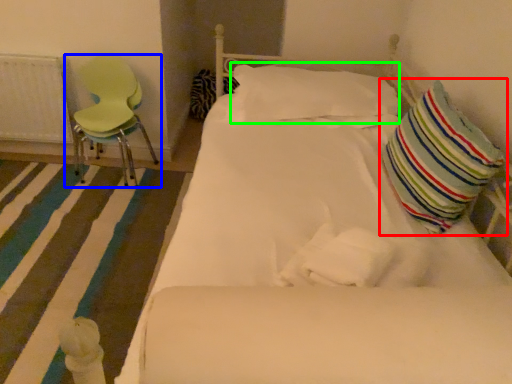
Question: Based on their relative distances, which object is farther from pillow (highlighted by a red box)? Choose from chair (highlighted by a blue box) and pillow (highlighted by a green box).

Choices:
 (A) chair
 (B) pillow

Answer: (A)